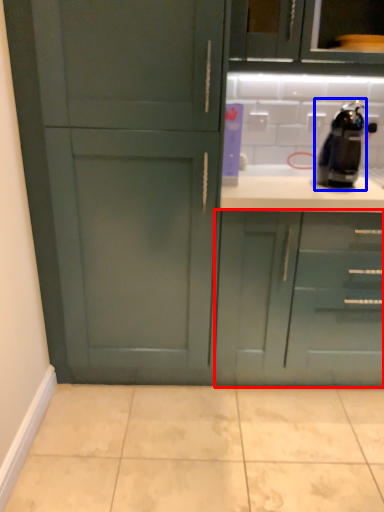
Question: Which object is closer to the camera taking this photo, cabinetry (highlighted by a red box) or coffee machine (highlighted by a blue box)?

Choices:
 (A) cabinetry
 (B) coffee machine

Answer: (B)